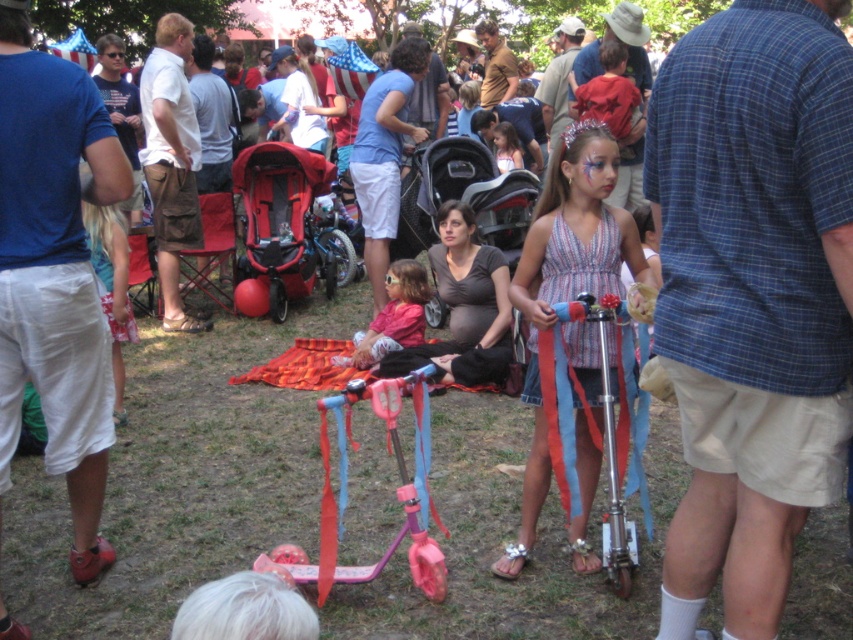
You are a photographer at the event and want to capture a photo of the striped fabric dress at center without the matte pink scooter at center appearing in the background. Is this possible based on their positions?

The striped fabric dress at center is in front of the matte pink scooter at center, so yes, the dress will block the scooter from view, making it possible to take a photo of the striped fabric dress at center without the matte pink scooter at center in the background.

You are a photographer at the event and want to capture both the striped fabric dress at center and the matte pink scooter at center in a single shot. Which object should you focus on first to ensure both are in frame?

The striped fabric dress at center is taller than the matte pink scooter at center, so focus on the striped fabric dress at center first to ensure the entire height of both objects fits within the frame.